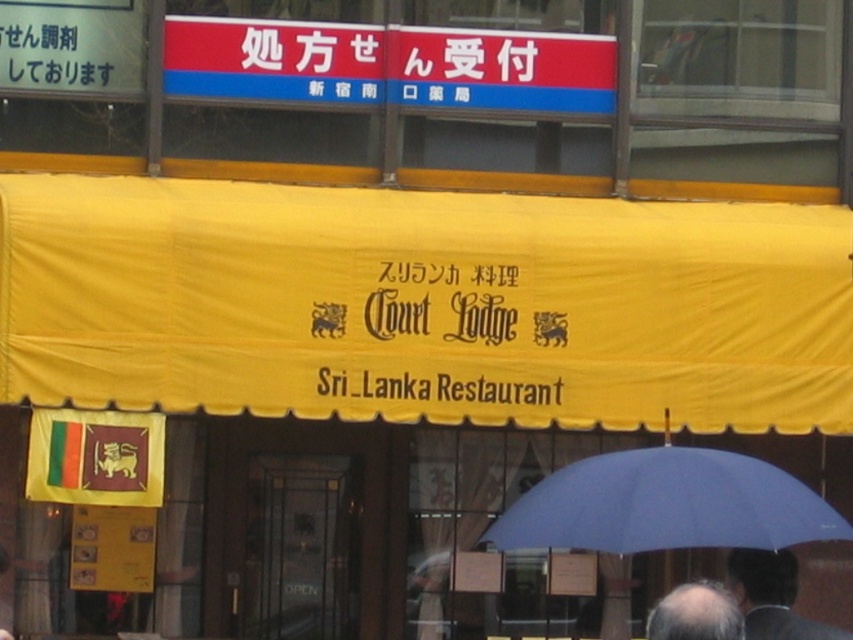
You are a photographer standing at the entrance of the restaurant. You want to take a photo of the bald head at lower center and the blue fabric umbrella at lower center. Which object will appear wider in the photo?

The blue fabric umbrella at lower center will appear wider in the photo because its width is larger than the bald head at lower center.

Looking at this image, you are a photographer standing outside the Court Lodge restaurant. You notice two people near the entrance. One has dark hair at lower right and the other has a bald head at lower center. Which person has a wider head?

The dark hair at lower right has a larger width than the bald head at lower center, so the person with dark hair at lower right has a wider head.

You are standing in front of the restaurant entrance. Where exactly is the yellow fabric canopy at center located in relation to the entrance?

The yellow fabric canopy at center is located at point (422,305) in relation to the entrance.